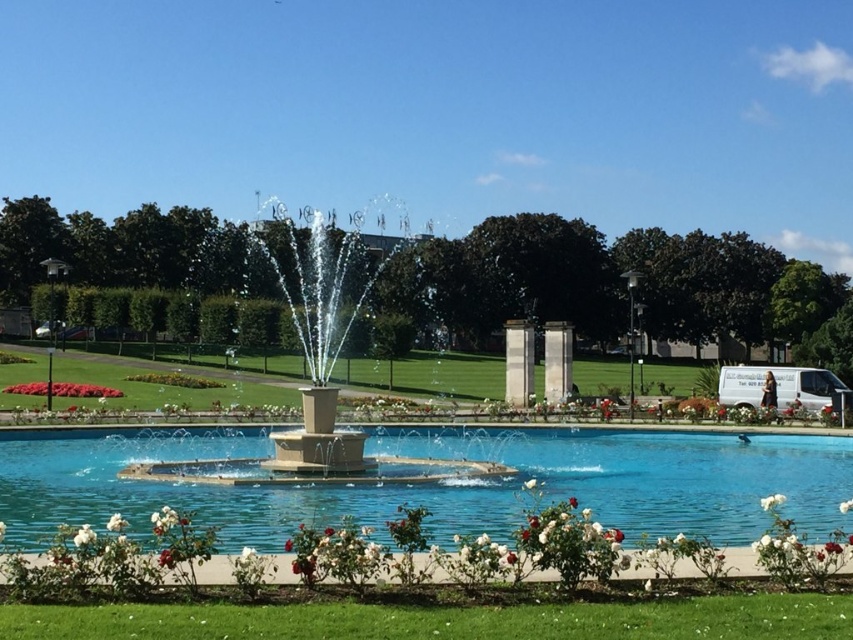
Can you confirm if red matte flowers at lower left is positioned above white fluffy flower at lower left?

No, red matte flowers at lower left is not above white fluffy flower at lower left.

Does red matte flowers at lower left have a smaller size compared to white fluffy flower at lower left?

Actually, red matte flowers at lower left might be larger than white fluffy flower at lower left.

You are a GUI agent. You are given a task and a screenshot of the screen. Output one action in this format:
    pyautogui.click(x=<x>, y=<y>)
    Task: Click on the red matte flowers at lower left
    This screenshot has width=853, height=640.
    Given the screenshot: What is the action you would take?
    pyautogui.click(x=62, y=388)

Image resolution: width=853 pixels, height=640 pixels. In order to click on red matte flowers at lower left in this screenshot , I will do `click(62, 388)`.

Is point (817, 468) in front of point (82, 544)?

That is False.

Identify the location of clear glass water at center. (442, 483).

Does white matte flower at lower center appear under white matte flower at center?

Incorrect, white matte flower at lower center is not positioned below white matte flower at center.

Is white matte flower at lower center to the left of white matte flower at center from the viewer's perspective?

Yes, white matte flower at lower center is to the left of white matte flower at center.

Find the location of `white matte flower at lower center`. white matte flower at lower center is located at coordinates (115, 522).